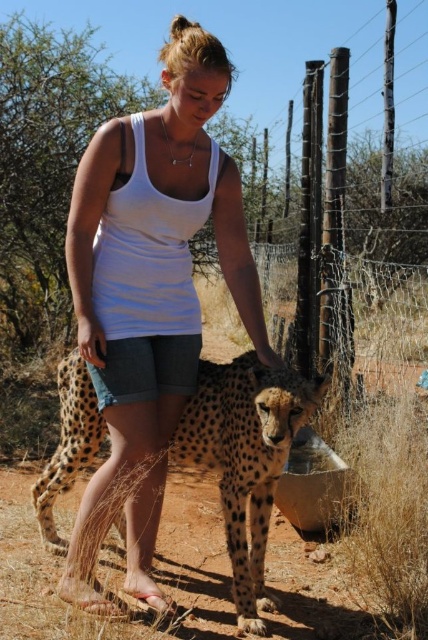
You are a photographer trying to capture a closeup shot of the spotted fur cheetah at center while ensuring the white fabric tank top at center is still visible in the frame. Given their relative sizes, will you need to adjust your camera angle to include both?

The white fabric tank top at center is wider than the spotted fur cheetah at center. To capture both in the frame, you may need to adjust your camera angle to accommodate the wider width of the white fabric tank top at center.

You are a wildlife photographer observing the scene. You notice the white fabric tank top at center and the spotted fur cheetah at center. Which object takes up more space in the image?

The white fabric tank top at center is bigger than the spotted fur cheetah at center, so it takes up more space in the image.

You are a photographer trying to capture a candid shot of the person interacting with the cheetahs. To ensure the best lighting, you need to position yourself so that the white fabric tank top at center is visible. Where should you position yourself relative to the person to capture the tank top?

To capture the white fabric tank top at center, you should position yourself so that you can see the coordinates point at 0.464 on the x axis and 0.350 on the y axis relative to the person.